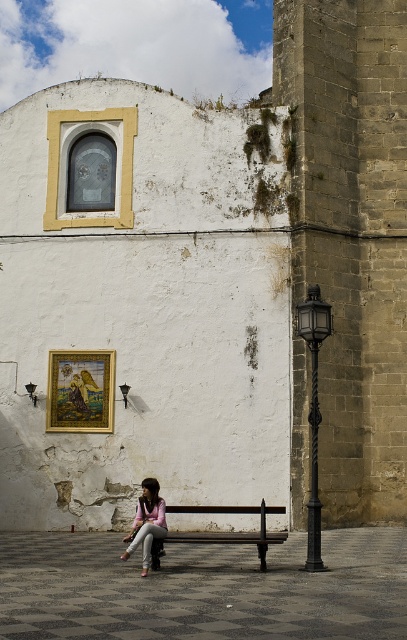
Does wooden bench at center appear over pink fabric jacket at lower center?

No, wooden bench at center is not above pink fabric jacket at lower center.

Which is in front, point (201, 536) or point (144, 486)?

Point (144, 486)

Locate an element on the screen. wooden bench at center is located at coordinates (223, 531).

Who is more forward, (313, 388) or (159, 506)?

Point (313, 388)

Is black wrought iron streetlight at right taller than pink fabric jacket at lower center?

Yes.

Between point (315, 480) and point (155, 518), which one is positioned behind?

The point (155, 518) is behind.

In order to click on black wrought iron streetlight at right in this screenshot , I will do point(313,410).

Which is below, black wrought iron streetlight at right or wooden bench at center?

wooden bench at center

Who is more forward, (312,371) or (196,531)?

Point (312,371)

Is point (306, 316) positioned before point (177, 532)?

Yes, it is.

Image resolution: width=407 pixels, height=640 pixels. Identify the location of black wrought iron streetlight at right. (313, 410).